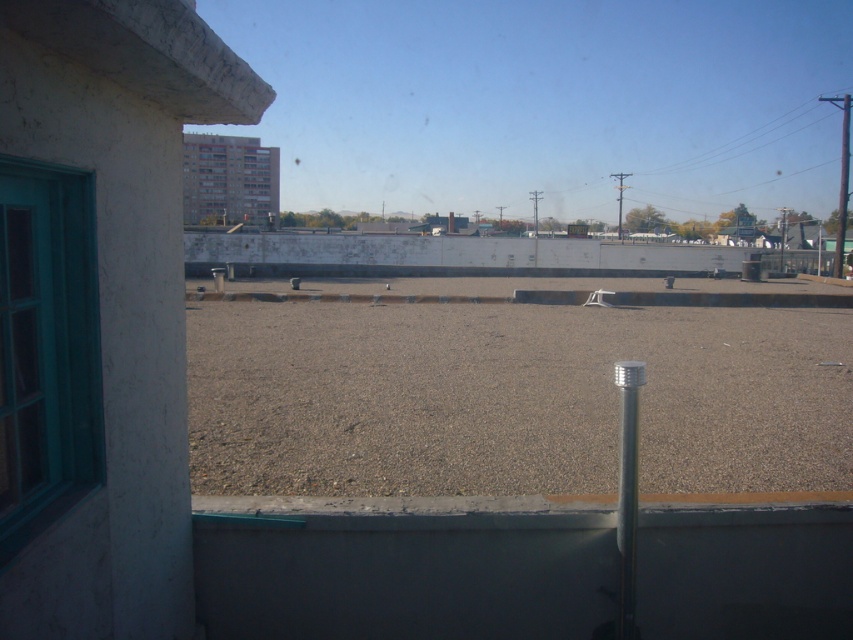
Question: Does teal glass window at left have a lesser width compared to metallic pole at right?

Choices:
 (A) no
 (B) yes

Answer: (B)

Question: Does brown gravel at center have a smaller size compared to matte glass window at upper center?

Choices:
 (A) no
 (B) yes

Answer: (B)

Question: Which of the following is the farthest from the observer?

Choices:
 (A) brown gravel at center
 (B) silver metallic pole at center
 (C) teal glass window at left

Answer: (B)

Question: Which point is farther from the camera taking this photo?

Choices:
 (A) (425, 492)
 (B) (625, 177)

Answer: (B)

Question: Which object is the farthest from the silver metallic pole at center?

Choices:
 (A) metallic pole at upper right
 (B) matte glass window at upper center
 (C) teal glass window at left

Answer: (A)

Question: Is matte glass window at upper center to the left of silver metallic pole at center from the viewer's perspective?

Choices:
 (A) no
 (B) yes

Answer: (B)